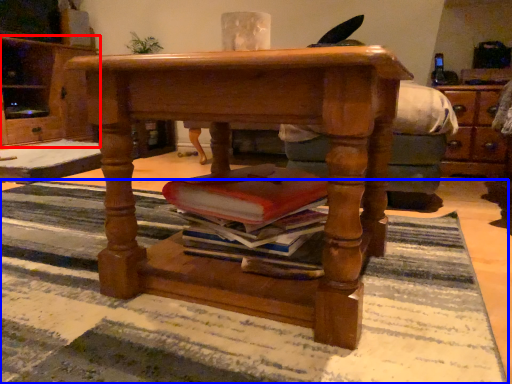
Question: Among these objects, which one is farthest to the camera, cabinetry (highlighted by a red box) or mat (highlighted by a blue box)?

Choices:
 (A) cabinetry
 (B) mat

Answer: (A)